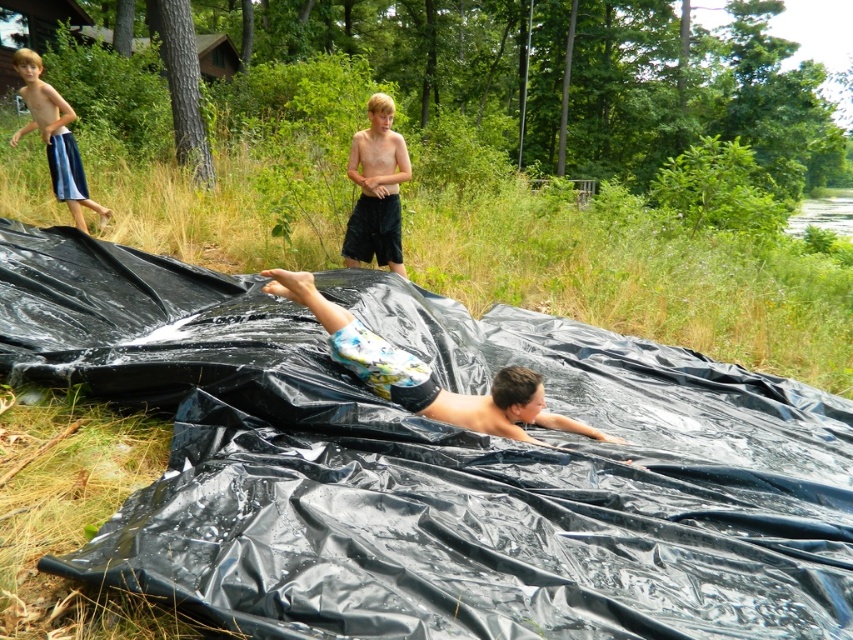
Does point (416, 403) lie in front of point (379, 161)?

That is True.

Who is positioned more to the right, floral shorts at center or light brown shorts at upper center?

Positioned to the right is floral shorts at center.

Describe the element at coordinates (426, 372) in the screenshot. I see `floral shorts at center` at that location.

Find the location of `floral shorts at center`. floral shorts at center is located at coordinates (426, 372).

Between point (778, 429) and point (90, 134), which one is positioned behind?

Positioned behind is point (90, 134).

Find the location of `black plastic tarp at center`. black plastic tarp at center is located at coordinates (434, 464).

Is point (280, 490) farther from viewer compared to point (503, 269)?

That is False.

I want to click on black plastic tarp at center, so click(434, 464).

Does green grass at lower center appear over blue striped shorts at upper left?

Yes, green grass at lower center is above blue striped shorts at upper left.

How distant is green grass at lower center from blue striped shorts at upper left?

green grass at lower center and blue striped shorts at upper left are 5.89 meters apart.

Is point (778, 262) more distant than point (80, 200)?

Yes.

The height and width of the screenshot is (640, 853). I want to click on green grass at lower center, so click(636, 278).